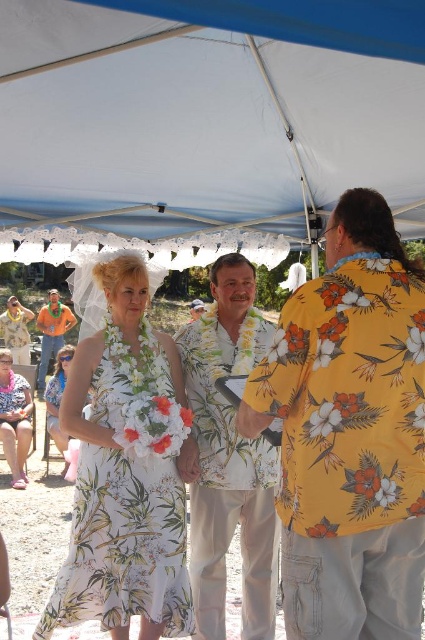
Question: Does white fabric canopy at upper center appear over yellow floral shirt at right?

Choices:
 (A) yes
 (B) no

Answer: (A)

Question: Which point is farther from the camera taking this photo?

Choices:
 (A) (8, 392)
 (B) (212, 532)
 (C) (401, 342)

Answer: (A)

Question: Is white floral shirt at center behind white floral print dress at center?

Choices:
 (A) yes
 (B) no

Answer: (A)

Question: Which object is positioned farthest from the white floral print dress at center?

Choices:
 (A) white fabric canopy at upper center
 (B) white floral shirt at center
 (C) orange fabric shirt at upper left
 (D) white floral dress at lower left

Answer: (C)

Question: Which point is farther to the camera?

Choices:
 (A) (121, 42)
 (B) (45, 360)

Answer: (B)

Question: Is yellow floral shirt at right closer to the viewer compared to white floral shirt at center?

Choices:
 (A) no
 (B) yes

Answer: (B)